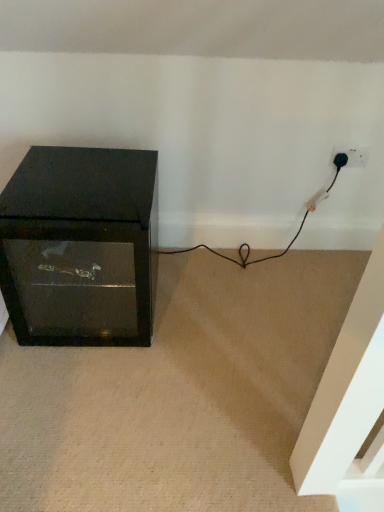
The width and height of the screenshot is (384, 512). What are the coordinates of `black plastic plug at lower right` in the screenshot? It's located at (340, 160).

This screenshot has width=384, height=512. Describe the element at coordinates (340, 160) in the screenshot. I see `black plastic plug at lower right` at that location.

I want to click on matte black cabinet at left, so click(x=81, y=246).

Measure the distance between point (x=35, y=224) and camera.

Point (x=35, y=224) is 3.63 feet from camera.

In order to face matte black cabinet at left, should I rotate leftwards or rightwards?

Rotate your view left by about 13.767°.

This screenshot has width=384, height=512. What do you see at coordinates (81, 246) in the screenshot?
I see `matte black cabinet at left` at bounding box center [81, 246].

Find the location of a particular element. black plastic plug at lower right is located at coordinates (340, 160).

Is matte black cabinet at left to the left or to the right of black plastic plug at lower right in the image?

In the image, matte black cabinet at left appears on the left side of black plastic plug at lower right.

Which object is more forward, matte black cabinet at left or black plastic plug at lower right?

matte black cabinet at left is closer to the camera.

Does point (81, 152) appear closer or farther from the camera than point (342, 159)?

Point (81, 152) is positioned closer to the camera compared to point (342, 159).

From the image's perspective, which one is positioned higher, matte black cabinet at left or black plastic plug at lower right?

black plastic plug at lower right.

From a real-world perspective, is matte black cabinet at left beneath black plastic plug at lower right?

Yes, from a real-world perspective, matte black cabinet at left is under black plastic plug at lower right.

Considering the relative sizes of matte black cabinet at left and black plastic plug at lower right in the image provided, is matte black cabinet at left thinner than black plastic plug at lower right?

Incorrect, the width of matte black cabinet at left is not less than that of black plastic plug at lower right.

Between matte black cabinet at left and black plastic plug at lower right, which one has more height?

matte black cabinet at left is taller.

Does matte black cabinet at left have a larger size compared to black plastic plug at lower right?

Yes.

In the scene shown: Would you say matte black cabinet at left is outside black plastic plug at lower right?

Yes, matte black cabinet at left is not within black plastic plug at lower right.

Would you consider matte black cabinet at left to be distant from black plastic plug at lower right?

matte black cabinet at left is positioned a significant distance from black plastic plug at lower right.

Could you tell me if matte black cabinet at left is turned towards black plastic plug at lower right?

No, matte black cabinet at left is not oriented towards black plastic plug at lower right.

Looking at this image, how far apart are matte black cabinet at left and black plastic plug at lower right?

matte black cabinet at left and black plastic plug at lower right are 3.32 feet apart from each other.

Find the location of a particular element. The height and width of the screenshot is (512, 384). furniture located on the left of black plastic plug at lower right is located at coordinates (81, 246).

Which object is positioned more to the right, black plastic plug at lower right or matte black cabinet at left?

black plastic plug at lower right is more to the right.

Which object is closer to the camera taking this photo, black plastic plug at lower right or matte black cabinet at left?

matte black cabinet at left is in front.

Between point (342, 153) and point (152, 236), which one is positioned behind?

The point (152, 236) is farther from the camera.

From the image's perspective, which object appears higher, black plastic plug at lower right or matte black cabinet at left?

black plastic plug at lower right appears higher in the image.

From a real-world perspective, which object stands above the other?

black plastic plug at lower right is physically above.

Which of these two, black plastic plug at lower right or matte black cabinet at left, is wider?

matte black cabinet at left.

Which of these two, black plastic plug at lower right or matte black cabinet at left, stands shorter?

With less height is black plastic plug at lower right.

Considering the sizes of objects black plastic plug at lower right and matte black cabinet at left in the image provided, who is bigger, black plastic plug at lower right or matte black cabinet at left?

With larger size is matte black cabinet at left.

Do you think black plastic plug at lower right is within matte black cabinet at left, or outside of it?

black plastic plug at lower right exists outside the volume of matte black cabinet at left.

Is black plastic plug at lower right with matte black cabinet at left?

There is a gap between black plastic plug at lower right and matte black cabinet at left.

Could you tell me if black plastic plug at lower right is facing matte black cabinet at left?

No, black plastic plug at lower right is not aimed at matte black cabinet at left.

How different are the orientations of black plastic plug at lower right and matte black cabinet at left in degrees?

The angular difference between black plastic plug at lower right and matte black cabinet at left is 0.000649 degrees.

Identify the location of furniture in front of the black plastic plug at lower right. (81, 246).

What are the coordinates of `furniture in front of the black plastic plug at lower right` in the screenshot? It's located at (81, 246).

At what (x,y) coordinates should I click in order to perform the action: click on plug positioned vertically above the matte black cabinet at left (from a real-world perspective). Please return your answer as a coordinate pair (x, y). The height and width of the screenshot is (512, 384). Looking at the image, I should click on (340, 160).